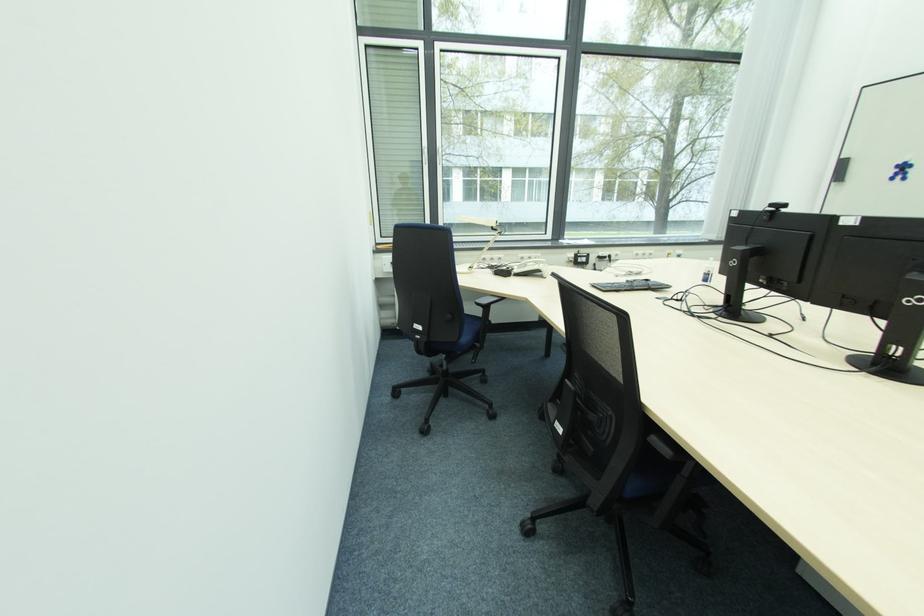
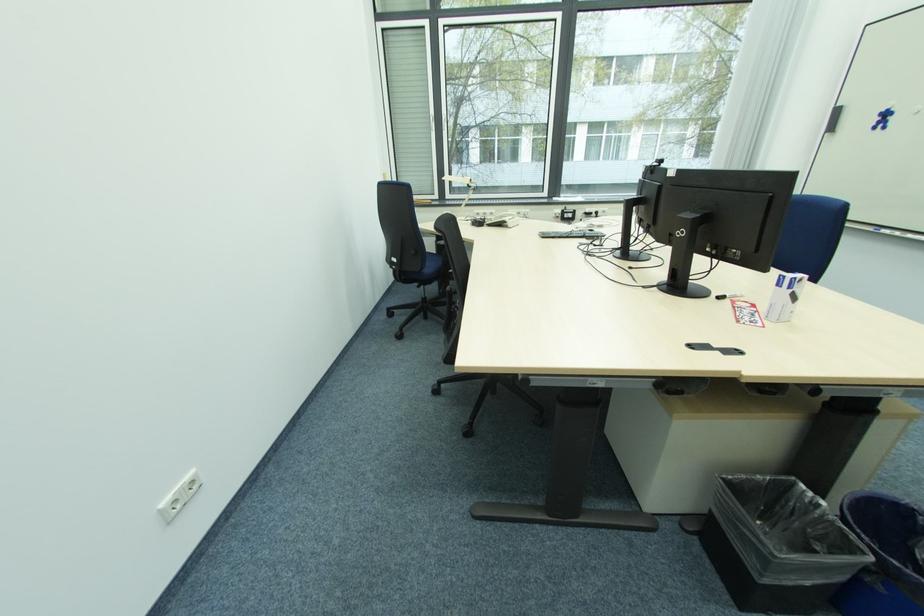
The point at [463,341] is marked in the first image. Where is the corresponding point in the second image?

(427, 272)